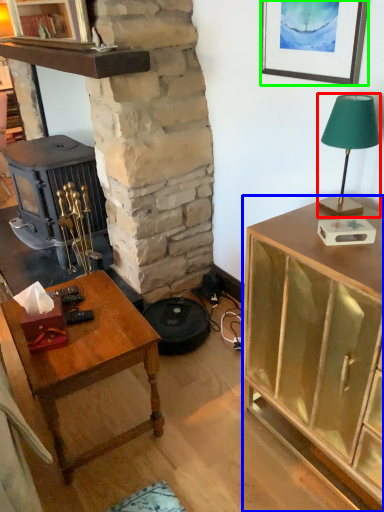
Question: Estimate the real-world distances between objects in this image. Which object is closer to lamp (highlighted by a red box), cabinetry (highlighted by a blue box) or picture frame (highlighted by a green box)?

Choices:
 (A) cabinetry
 (B) picture frame

Answer: (B)